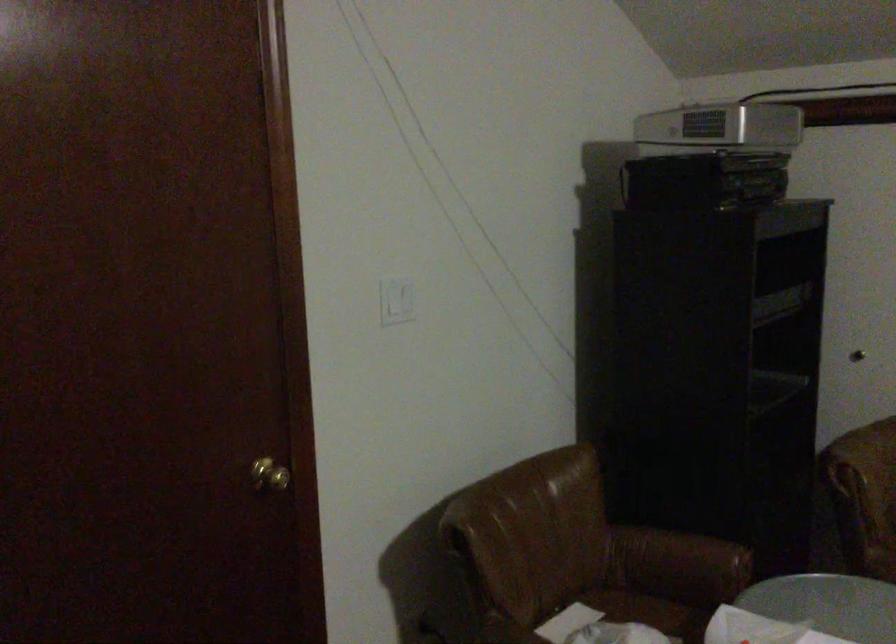
The image size is (896, 644). What do you see at coordinates (269, 476) in the screenshot?
I see `the brass doorknob` at bounding box center [269, 476].